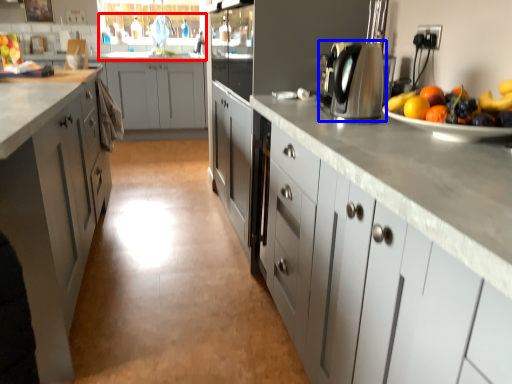
Question: Which of the following is the farthest to the observer, sink (highlighted by a red box) or home appliance (highlighted by a blue box)?

Choices:
 (A) sink
 (B) home appliance

Answer: (A)